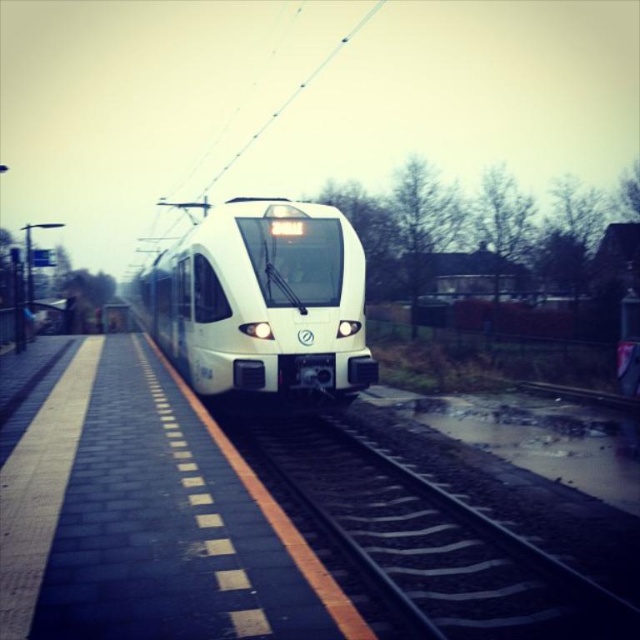
Does black metal train track at center appear under white glossy train at center?

Correct, black metal train track at center is located below white glossy train at center.

Who is more distant from viewer, (246, 445) or (195, 260)?

The point (195, 260) is behind.

Is point (464, 518) positioned behind point (340, 221)?

No, it is not.

The image size is (640, 640). What are the coordinates of `black metal train track at center` in the screenshot? It's located at (428, 541).